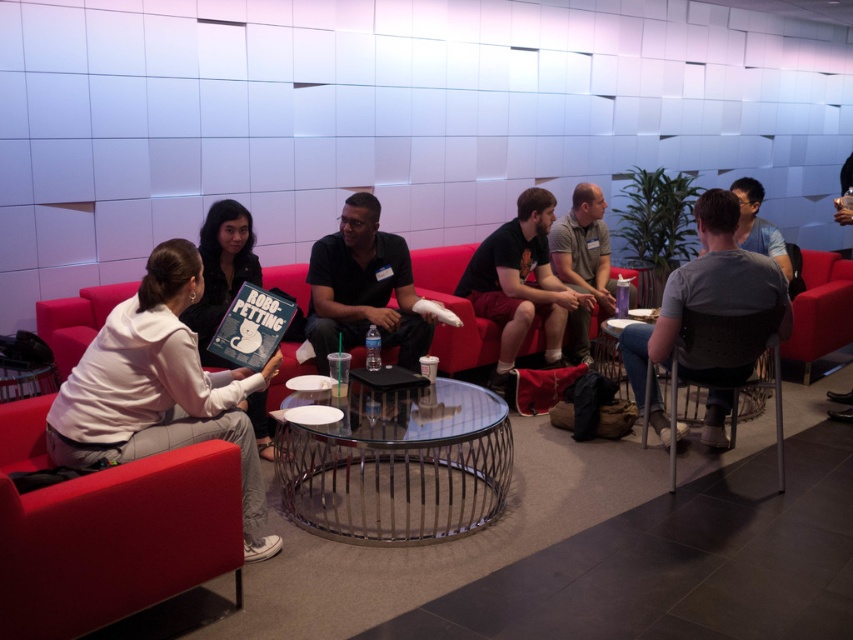
You are a guest at the gathering and want to place a small plant between the white cotton hoodie at left and the matte white couch at left. Based on their heights, which object should the plant be placed closer to?

The plant should be placed closer to the matte white couch at left because the white cotton hoodie at left is taller than the matte white couch at left, so the couch is shorter and the plant would be more stable there.

You are organizing a small book club meeting in this lounge and need to move a chair closer to the sofa for an additional participant. The white cotton hoodie at left is currently occupying the space between the sofa and the matte black chair at center. Can you move the hoodie to make space?

The white cotton hoodie at left is to the left of the matte black chair at center, so moving the hoodie from its current position to the left would create space between the sofa and the matte black chair at center for the additional chair.